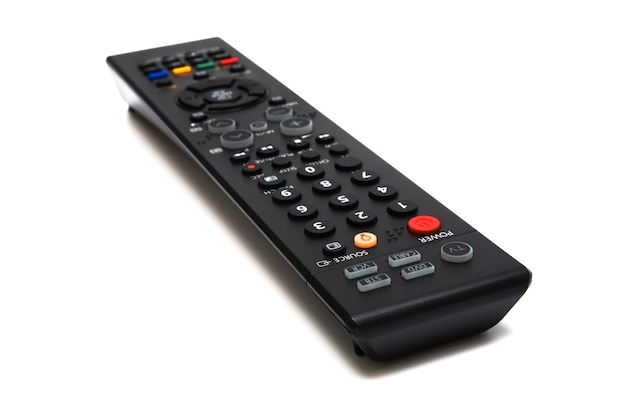
Find the location of a particular element. number buttons on remote is located at coordinates (329, 228), (371, 219), (397, 205), (382, 190), (344, 200), (313, 205), (289, 195), (326, 188), (361, 174), (313, 170).